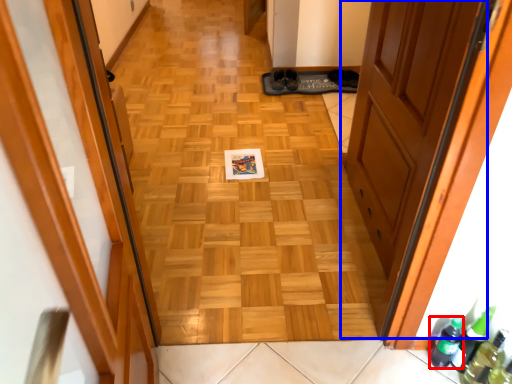
Question: Which object appears closest to the camera in this image, beer bottle (highlighted by a red box) or door (highlighted by a blue box)?

Choices:
 (A) beer bottle
 (B) door

Answer: (B)